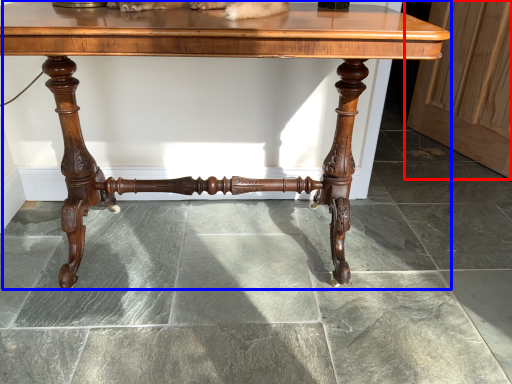
Question: Which object appears closest to the camera in this image, screen door (highlighted by a red box) or table (highlighted by a blue box)?

Choices:
 (A) screen door
 (B) table

Answer: (B)